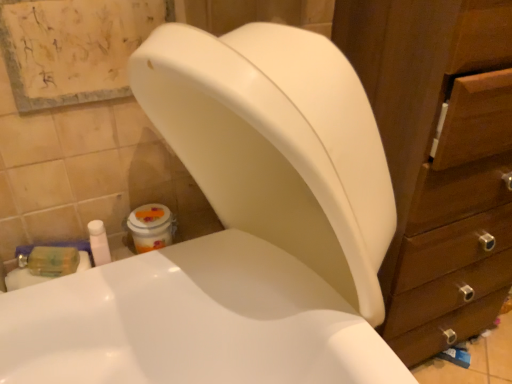
Question: Does point (96, 246) appear closer or farther from the camera than point (509, 48)?

Choices:
 (A) closer
 (B) farther

Answer: (B)

Question: Is white plastic bottle at lower left in front of or behind wooden cabinet at right in the image?

Choices:
 (A) front
 (B) behind

Answer: (B)

Question: In terms of height, does white plastic bottle at lower left look taller or shorter compared to wooden cabinet at right?

Choices:
 (A) short
 (B) tall

Answer: (A)

Question: In terms of width, does wooden cabinet at right look wider or thinner when compared to white plastic bottle at lower left?

Choices:
 (A) thin
 (B) wide

Answer: (B)

Question: Is point (400, 193) positioned closer to the camera than point (99, 264)?

Choices:
 (A) farther
 (B) closer

Answer: (B)

Question: Is wooden cabinet at right inside or outside of white plastic bottle at lower left?

Choices:
 (A) outside
 (B) inside

Answer: (A)

Question: Based on their sizes in the image, would you say wooden cabinet at right is bigger or smaller than white plastic bottle at lower left?

Choices:
 (A) big
 (B) small

Answer: (A)